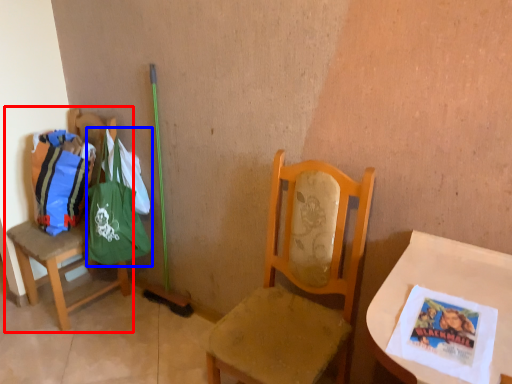
Question: Which object appears closest to the camera in this image, chair (highlighted by a red box) or shoulder bag (highlighted by a blue box)?

Choices:
 (A) chair
 (B) shoulder bag

Answer: (A)